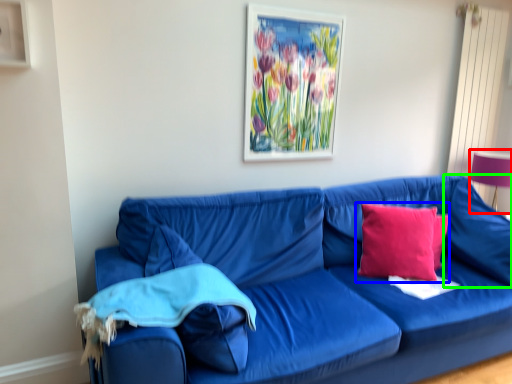
Question: Which object is the farthest from table lamp (highlighted by a red box)? Choose among these: pillow (highlighted by a blue box) or pillow (highlighted by a green box).

Choices:
 (A) pillow
 (B) pillow

Answer: (A)